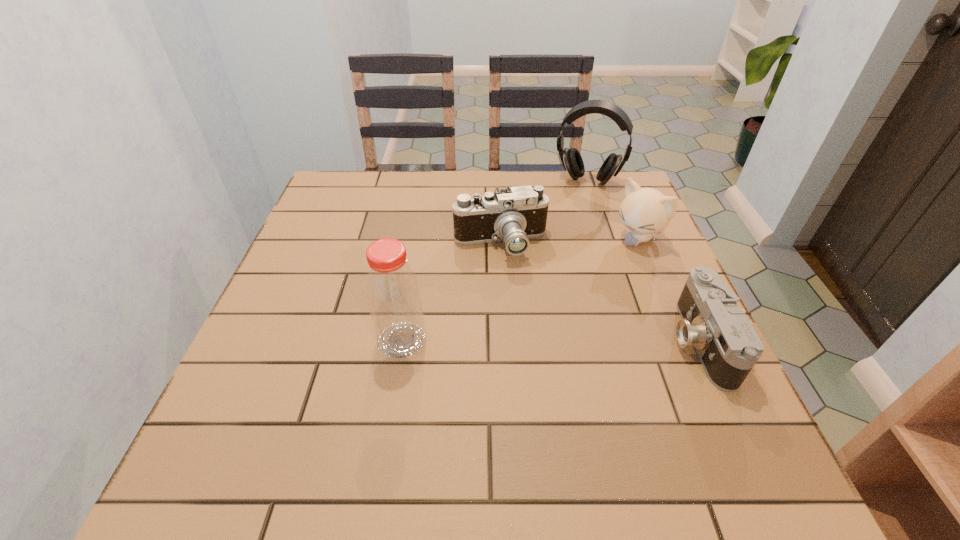
You are a GUI agent. You are given a task and a screenshot of the screen. Output one action in this format:
    pyautogui.click(x=<x>, y=<y>)
    Task: Click on the bottle
    
    Given the screenshot: What is the action you would take?
    pyautogui.click(x=393, y=294)

Where is `the shortest object`? The image size is (960, 540). the shortest object is located at coordinates (728, 346).

The image size is (960, 540). What are the coordinates of `the right camera` in the screenshot? It's located at (728, 346).

Image resolution: width=960 pixels, height=540 pixels. Find the location of `the third tallest object`. the third tallest object is located at coordinates (646, 212).

At what (x,y) coordinates should I click in order to perform the action: click on the farthest object. Please return your answer as a coordinate pair (x, y). The image size is (960, 540). Looking at the image, I should click on (571, 159).

Locate an element on the screen. This screenshot has width=960, height=540. the farther camera is located at coordinates (514, 214).

The image size is (960, 540). I want to click on the second object from left to right, so click(514, 214).

Where is `free space located on the back of the leftmost object`? free space located on the back of the leftmost object is located at coordinates (417, 253).

Identify the location of free spot located 0.360m on the lens of the nearer camera. The width and height of the screenshot is (960, 540). (496, 341).

Where is `free region located on the lens of the nearer camera`? free region located on the lens of the nearer camera is located at coordinates (619, 341).